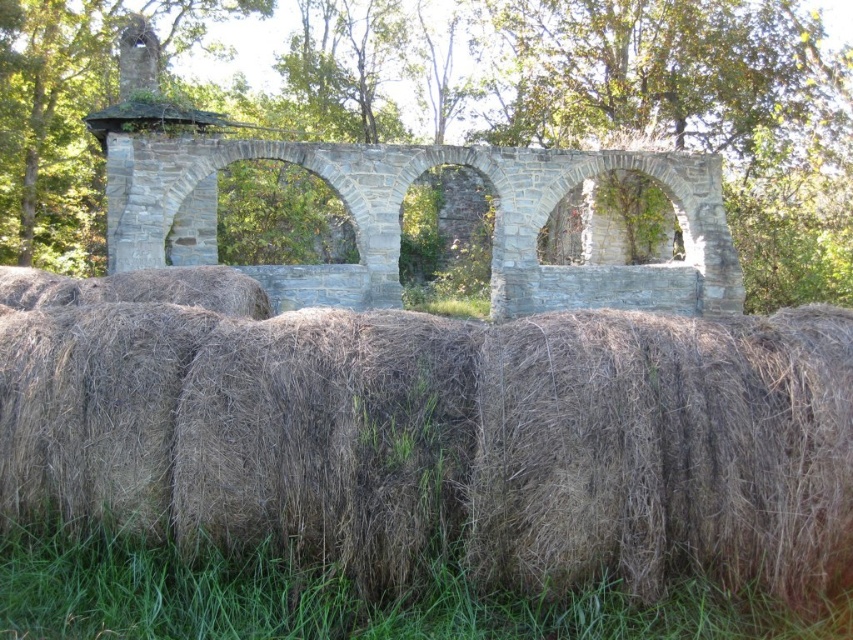
Identify the location of brown straw bales at lower center. The image size is (853, 640). (432, 433).

Where is `brown straw bales at lower center`? This screenshot has width=853, height=640. brown straw bales at lower center is located at coordinates (432, 433).

The width and height of the screenshot is (853, 640). Identify the location of gray stone arches at center. (398, 224).

Does gray stone arches at center appear over dry straw at lower center?

Correct, gray stone arches at center is located above dry straw at lower center.

Where is `gray stone arches at center`? Image resolution: width=853 pixels, height=640 pixels. gray stone arches at center is located at coordinates (398, 224).

You are a GUI agent. You are given a task and a screenshot of the screen. Output one action in this format:
    pyautogui.click(x=<x>, y=<y>)
    Task: Click on the gray stone arches at center
    
    Given the screenshot: What is the action you would take?
    pos(398,224)

From the picture: Does brown straw bales at lower center come in front of dry straw at lower center?

No, it is not.

What are the coordinates of `brown straw bales at lower center` in the screenshot? It's located at (432, 433).

The image size is (853, 640). In order to click on brown straw bales at lower center in this screenshot , I will do `click(432, 433)`.